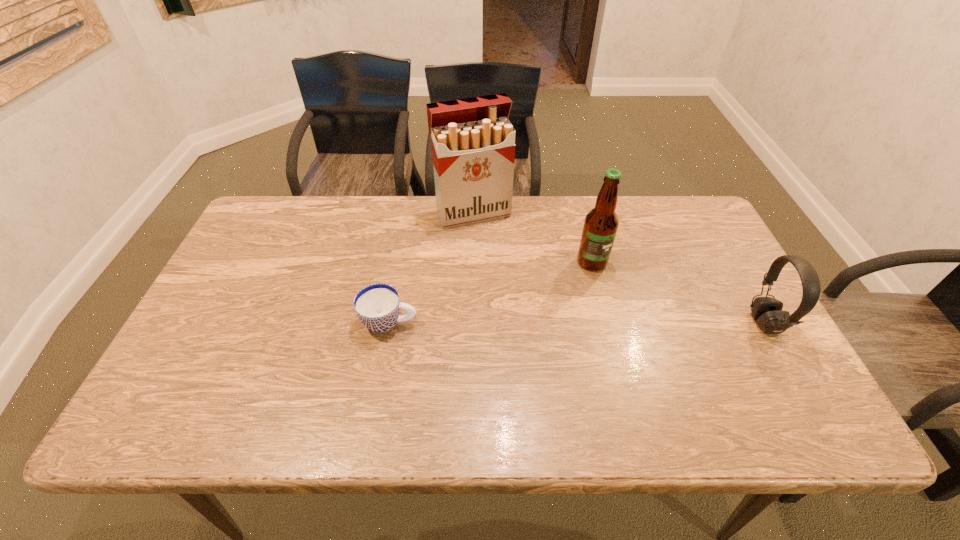
Locate an element on the screen. The height and width of the screenshot is (540, 960). free spot between the shortest object and the third nearest object is located at coordinates (491, 292).

You are a GUI agent. You are given a task and a screenshot of the screen. Output one action in this format:
    pyautogui.click(x=<x>, y=<y>)
    Task: Click on the vacant region between the second shortest object and the leftmost object
    The height and width of the screenshot is (540, 960).
    Given the screenshot: What is the action you would take?
    pyautogui.click(x=577, y=323)

Where is `free space between the cigarette case and the rightmost object`? The image size is (960, 540). free space between the cigarette case and the rightmost object is located at coordinates (619, 268).

Identify the location of vacant space that's between the second shortest object and the leftmost object. (577, 323).

At what (x,y) coordinates should I click in order to perform the action: click on object that stands as the second closest to the cigarette case. Please return your answer as a coordinate pair (x, y). The image size is (960, 540). Looking at the image, I should click on tap(377, 306).

Identify which object is the second closest to the headset. Please provide its 2D coordinates. Your answer should be formatted as a tuple, i.e. [(x, y)], where the tuple contains the x and y coordinates of a point satisfying the conditions above.

[(473, 142)]

The image size is (960, 540). What are the coordinates of `free space that satisfies the following two spatial constraints: 1. on the front side of the tallest object; 2. on the right side of the third nearest object` in the screenshot? It's located at (472, 262).

Where is `free location that satisfies the following two spatial constraints: 1. on the front side of the cigarette case; 2. on the front-facing side of the rightmost object`? The height and width of the screenshot is (540, 960). free location that satisfies the following two spatial constraints: 1. on the front side of the cigarette case; 2. on the front-facing side of the rightmost object is located at coordinates (471, 323).